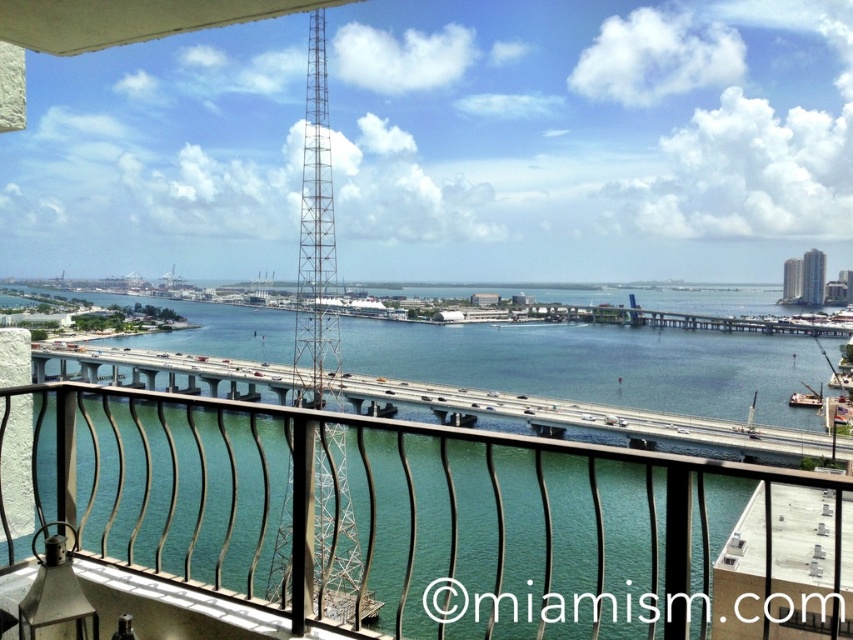
Looking at this image, you are standing on the balcony and want to take a photo of both the clear blue water at center and the metallic lattice tower at center. Which object will appear closer to you in the photo?

The clear blue water at center will appear closer to you in the photo because it is positioned further to the viewer than the metallic lattice tower at center.